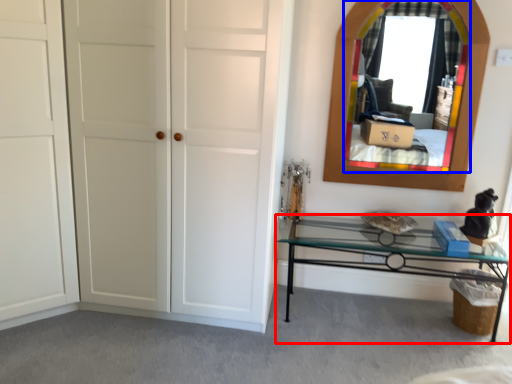
Question: Which point is closer to the camera, table (highlighted by a red box) or mirror (highlighted by a blue box)?

Choices:
 (A) table
 (B) mirror

Answer: (A)